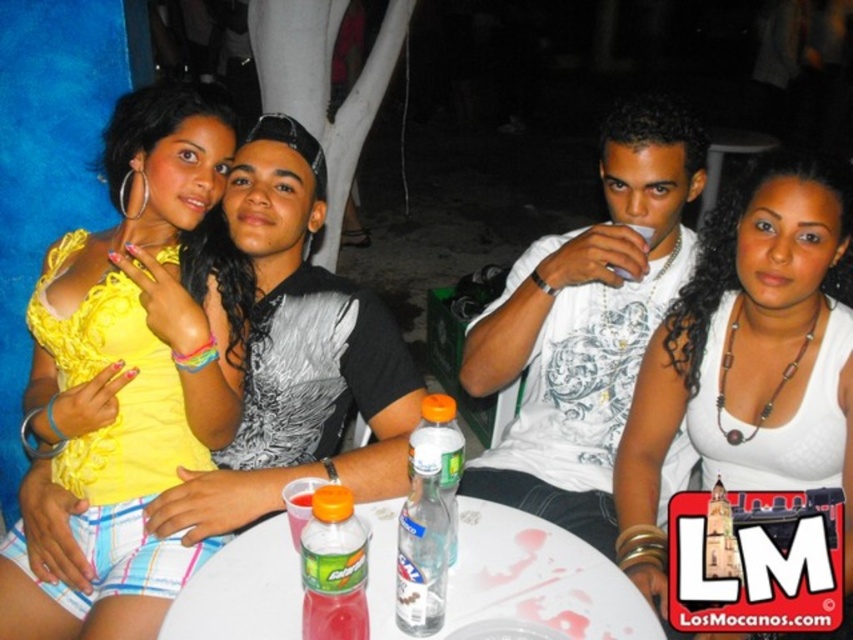
Which is more to the right, yellow woven tank top at upper left or white matte tank top at center?

white matte tank top at center

Between yellow woven tank top at upper left and white matte tank top at center, which one has less height?

With less height is white matte tank top at center.

Describe the element at coordinates (135, 308) in the screenshot. I see `yellow woven tank top at upper left` at that location.

At what (x,y) coordinates should I click in order to perform the action: click on yellow woven tank top at upper left. Please return your answer as a coordinate pair (x, y). This screenshot has height=640, width=853. Looking at the image, I should click on (135, 308).

Identify the location of white plastic table at center. (538, 579).

Is white plastic table at center behind translucent plastic bottle at table center?

Yes, it is.

Is point (206, 612) farther from camera compared to point (363, 541)?

That is True.

Find the location of a particular element. The height and width of the screenshot is (640, 853). white plastic table at center is located at coordinates (538, 579).

Is white matte tank top at center below translucent plastic bottle at table center?

No, white matte tank top at center is not below translucent plastic bottle at table center.

Does white matte tank top at center have a lesser width compared to translucent plastic bottle at table center?

No, white matte tank top at center is not thinner than translucent plastic bottle at table center.

Identify the location of white matte tank top at center. (751, 358).

You are a GUI agent. You are given a task and a screenshot of the screen. Output one action in this format:
    pyautogui.click(x=<x>, y=<y>)
    Task: Click on the white matte tank top at center
    This screenshot has height=640, width=853.
    Given the screenshot: What is the action you would take?
    pyautogui.click(x=751, y=358)